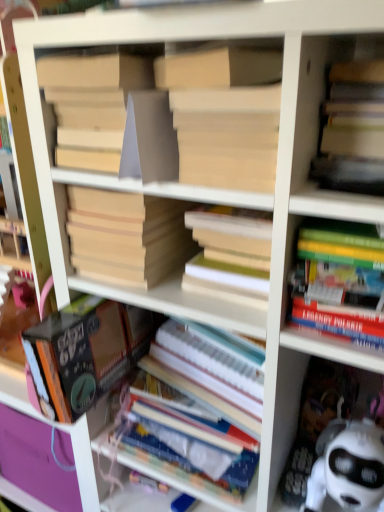
Question: Does point (360, 138) appear closer or farther from the camera than point (145, 280)?

Choices:
 (A) closer
 (B) farther

Answer: (A)

Question: Relative to beige cardboard book at center, the third book viewed from the top, is matte yellow book at upper right, the 5th book positioned from the bottom, in front or behind?

Choices:
 (A) front
 (B) behind

Answer: (A)

Question: Based on their relative distances, which object is farther from the matte yellow book at upper right, marked as the 2th book in a top-to-bottom arrangement?

Choices:
 (A) white paper at center, marked as the sixth book in a top-to-bottom arrangement
 (B) beige cardboard book at center, the third book viewed from the top
 (C) matte cardboard book at center, which is the 6th book in bottom-to-top order
 (D) hardcover book at center, which is the fifth book from top to bottom
 (E) hardcover books at right, the third book in the bottom-to-top sequence

Answer: (A)

Question: Based on their relative distances, which object is farther from the matte yellow book at upper right, marked as the 2th book in a top-to-bottom arrangement?

Choices:
 (A) hardcover books at right, which ranks as the fourth book in top-to-bottom order
 (B) white paper at center, marked as the sixth book in a top-to-bottom arrangement
 (C) matte cardboard book at center, which is the 6th book in bottom-to-top order
 (D) beige cardboard book at center, the third book viewed from the top
 (E) hardcover book at center, which is the second book from bottom to top

Answer: (B)